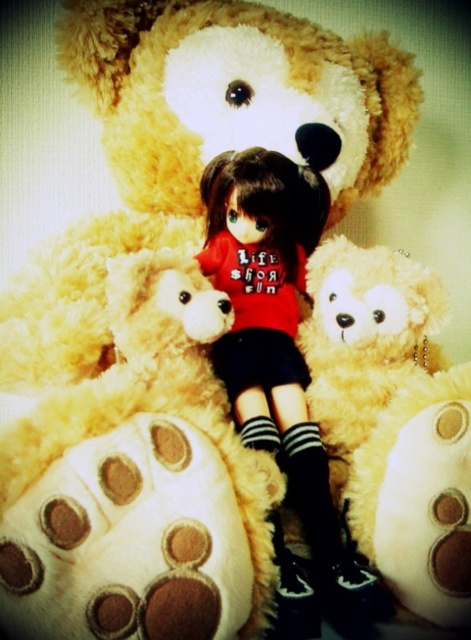
Between fluffy yellow teddy bear at center and matte red shirt at center, which one appears on the right side from the viewer's perspective?

Positioned to the right is matte red shirt at center.

Which is above, fluffy yellow teddy bear at center or matte red shirt at center?

Positioned higher is matte red shirt at center.

Which is in front, point (21, 419) or point (240, 284)?

Point (21, 419) is more forward.

Identify the location of fluffy yellow teddy bear at center. (138, 483).